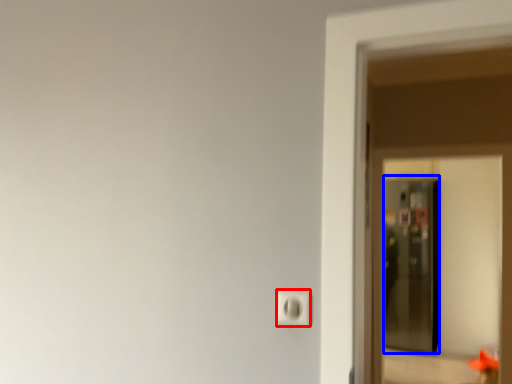
Question: Which point is further to the camera, light switch (highlighted by a red box) or screen door (highlighted by a blue box)?

Choices:
 (A) light switch
 (B) screen door

Answer: (B)